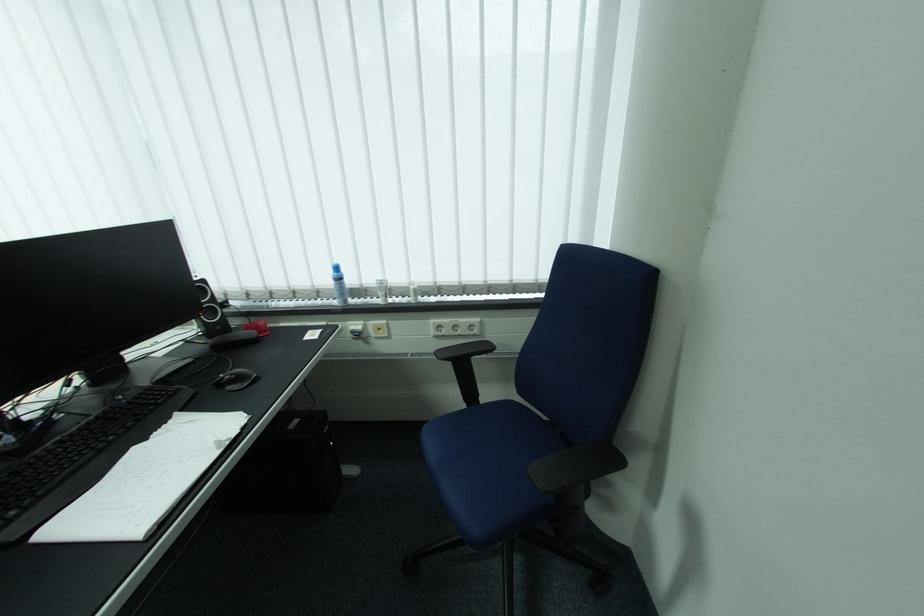
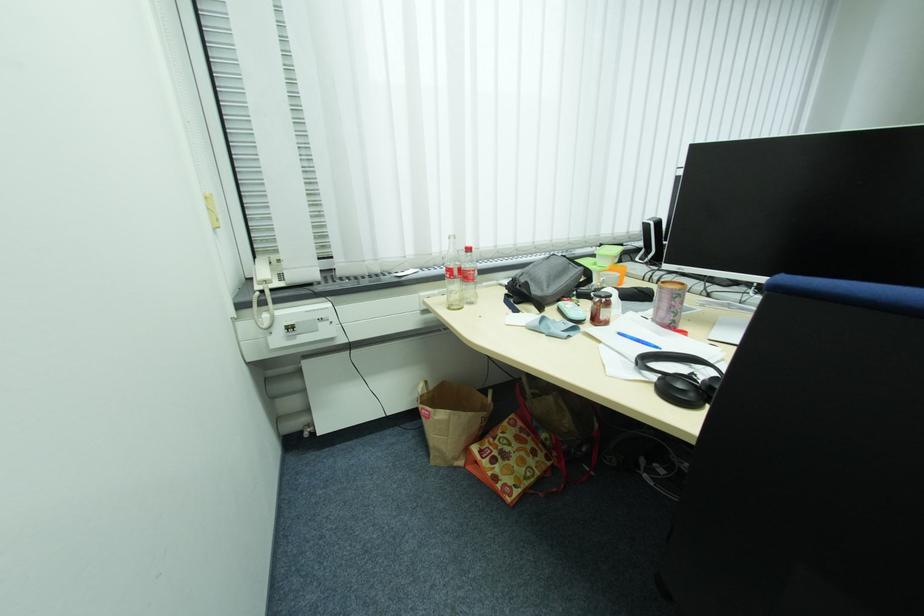
Question: I am providing you with two images of the same scene from different viewpoints. Please identify which objects are invisible in image2.

Choices:
 (A) brown paper bag
 (B) blue spray bottle
 (C) white broom handle
 (D) small glass jar

Answer: (B)